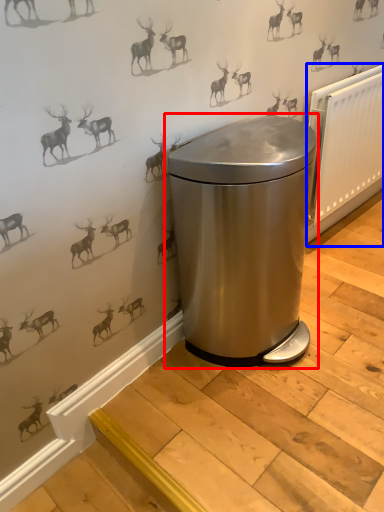
Question: Which object appears closest to the camera in this image, waste container (highlighted by a red box) or radiator (highlighted by a blue box)?

Choices:
 (A) waste container
 (B) radiator

Answer: (A)